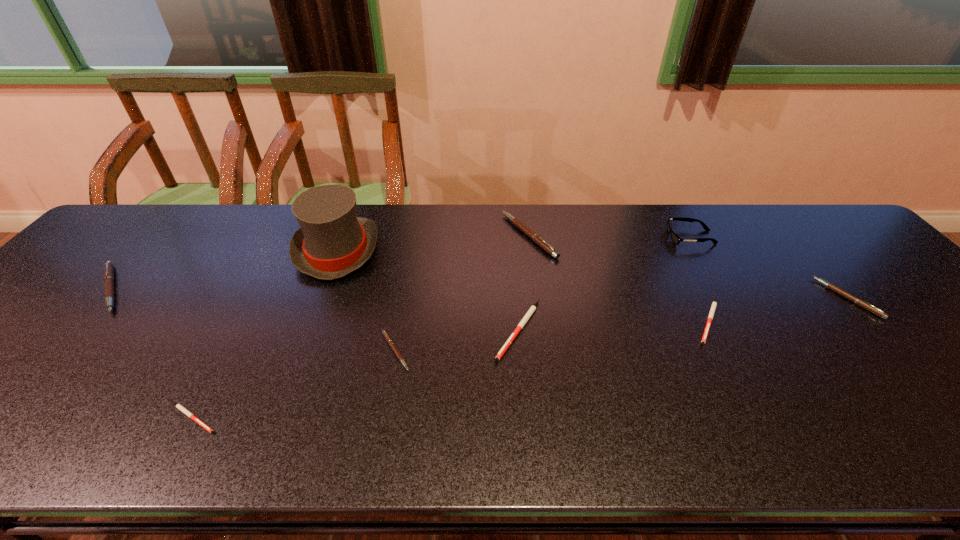
I want to click on free space located on the front-facing side of the sunglasses, so click(x=577, y=238).

What are the coordinates of `free location located 0.160m at the nib of the farthest pen` in the screenshot? It's located at (450, 235).

Locate an element on the screen. The width and height of the screenshot is (960, 540). free space located at the nib of the farthest pen is located at coordinates (433, 235).

Image resolution: width=960 pixels, height=540 pixels. I want to click on free location located 0.280m at the nib of the farthest pen, so click(410, 235).

Where is `vacant space located 0.060m at the nib of the second tallest pen`? The image size is (960, 540). vacant space located 0.060m at the nib of the second tallest pen is located at coordinates (158, 288).

I want to click on vacant space located 0.050m at the nib of the third biggest pink pen, so click(807, 298).

Where is `vacant area situated at the nib of the third biggest pink pen`? The height and width of the screenshot is (540, 960). vacant area situated at the nib of the third biggest pink pen is located at coordinates (686, 298).

Where is `free space located at the nib of the third biggest pink pen`? This screenshot has width=960, height=540. free space located at the nib of the third biggest pink pen is located at coordinates (709, 298).

Locate an element on the screen. Image resolution: width=960 pixels, height=540 pixels. free region located 0.200m on the clicker of the biggest white pen is located at coordinates (528, 451).

The height and width of the screenshot is (540, 960). In order to click on free location located at the nib of the smallest pink pen in this screenshot , I will do `click(500, 352)`.